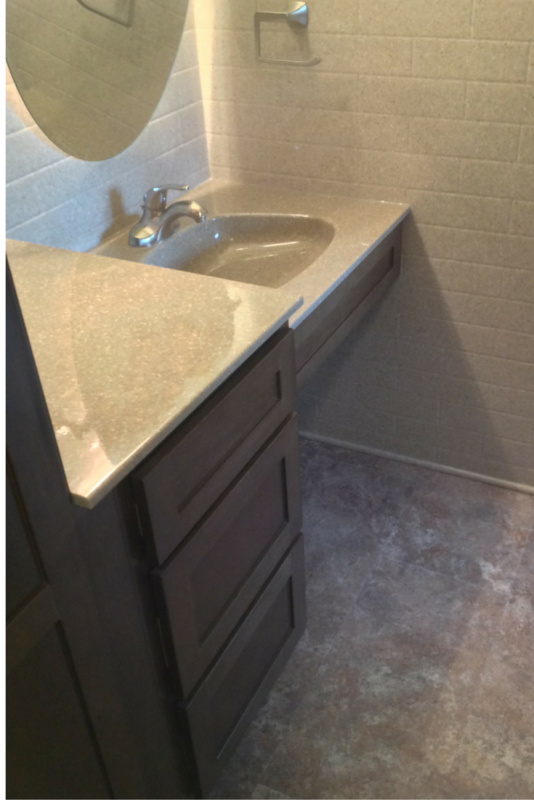
Find the location of `flooring`. flooring is located at coordinates (407, 629).